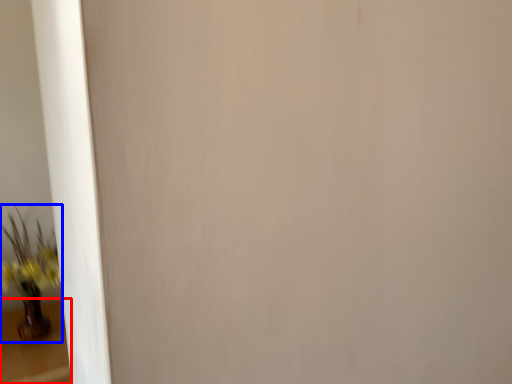
Question: Which of the following is the farthest to the observer, table (highlighted by a red box) or houseplant (highlighted by a blue box)?

Choices:
 (A) table
 (B) houseplant

Answer: (B)